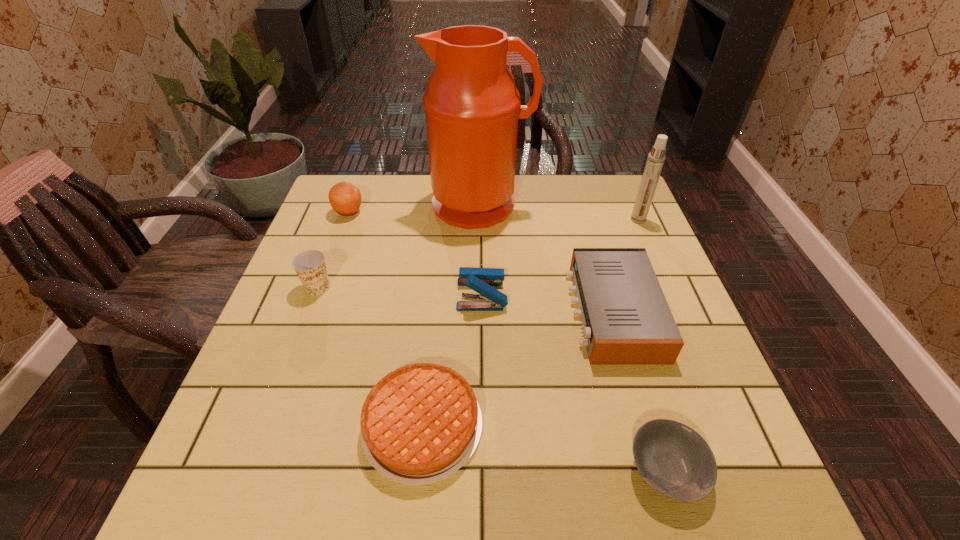
The image size is (960, 540). I want to click on blank area in the image that satisfies the following two spatial constraints: 1. on the control panel of the radio receiver; 2. on the back side of the bowl, so click(x=659, y=470).

At what (x,y) coordinates should I click in order to perform the action: click on free space that satisfies the following two spatial constraints: 1. from the spout of the tallest object; 2. on the left side of the stapler. Please return your answer as a coordinate pair (x, y). Looking at the image, I should click on (480, 294).

At what (x,y) coordinates should I click in order to perform the action: click on free space that satisfies the following two spatial constraints: 1. from the spout of the seventh shortest object; 2. on the left side of the tallest object. Please return your answer as a coordinate pair (x, y). The width and height of the screenshot is (960, 540). Looking at the image, I should click on (480, 219).